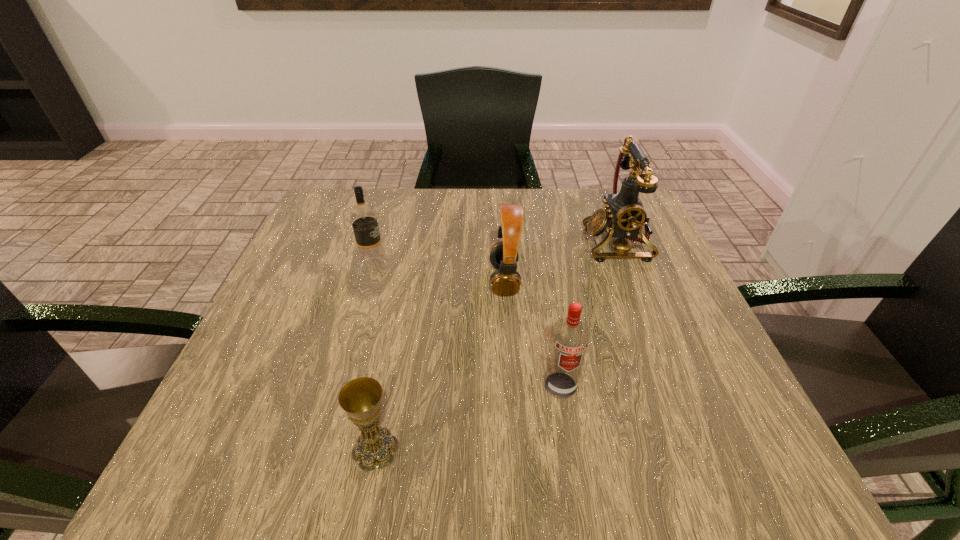
Image resolution: width=960 pixels, height=540 pixels. In order to click on vacant position in the image that satisfies the following two spatial constraints: 1. on the label of the leftmost object; 2. on the right side of the nearest object in this screenshot , I will do `click(322, 449)`.

Where is `vacant area that satisfies the following two spatial constraints: 1. on the label of the left vodka; 2. on the left side of the nearest object`? This screenshot has width=960, height=540. vacant area that satisfies the following two spatial constraints: 1. on the label of the left vodka; 2. on the left side of the nearest object is located at coordinates (322, 449).

At what (x,y) coordinates should I click in order to perform the action: click on blank space that satisfies the following two spatial constraints: 1. on the front of the tallest object, featuring the rotary dial; 2. on the front side of the shortest object. Please return your answer as a coordinate pair (x, y). This screenshot has width=960, height=540. Looking at the image, I should click on (699, 449).